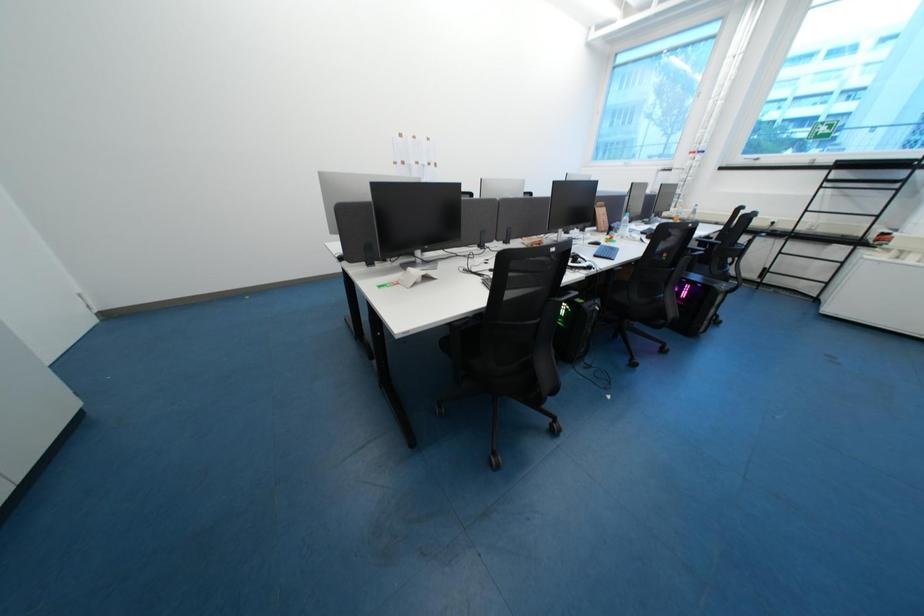
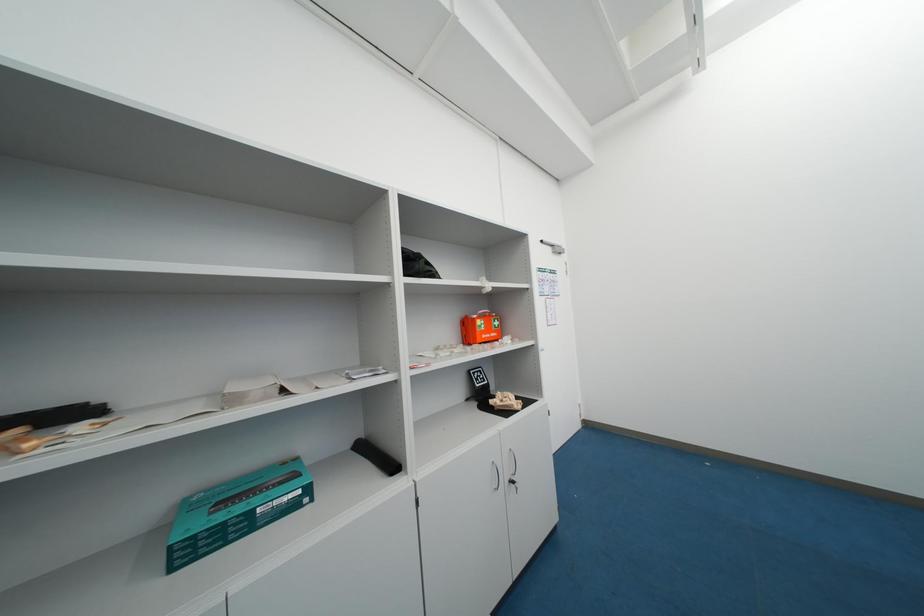
Question: The camera is either moving clockwise (left) or counter-clockwise (right) around the object. The first image is from the beginning of the video and the second image is from the end. Is the camera moving left or right when shooting the video?

Choices:
 (A) Left
 (B) Right

Answer: (B)